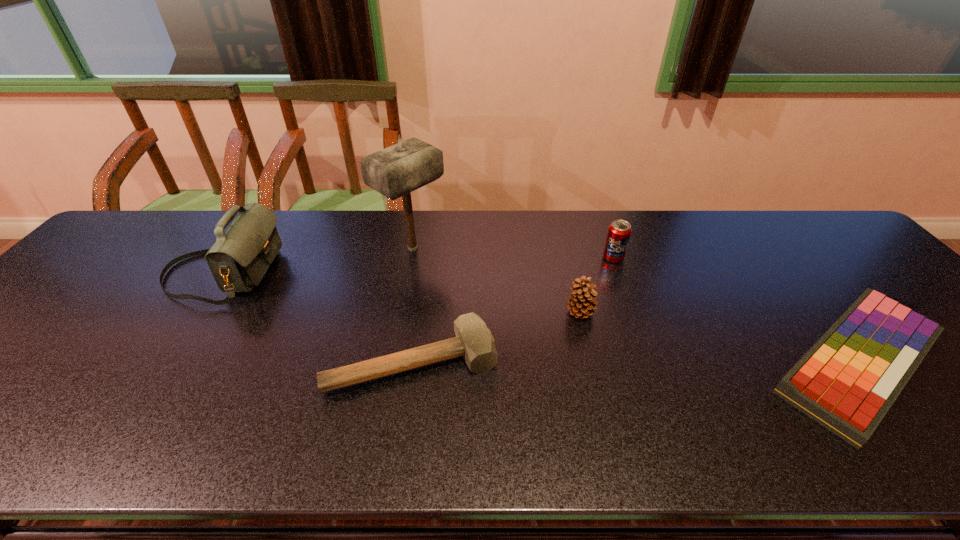
Where is `vacant area located on the back of the soda can`? The image size is (960, 540). vacant area located on the back of the soda can is located at coordinates (607, 239).

I want to click on free location located 0.330m on the left of the shorter mallet, so click(181, 362).

Locate an element on the screen. mallet that is positioned at the far edge is located at coordinates click(x=396, y=171).

Where is `shoulder bag at the far edge`? The height and width of the screenshot is (540, 960). shoulder bag at the far edge is located at coordinates (238, 260).

I want to click on soda can that is at the far edge, so click(619, 231).

Locate an element on the screen. blank space at the far edge of the desktop is located at coordinates (448, 253).

Identify the location of free space at the near edge of the desktop. The height and width of the screenshot is (540, 960). (937, 428).

I want to click on blank space at the left edge of the desktop, so click(x=15, y=354).

I want to click on vacant space at the right edge of the desktop, so click(904, 299).

Where is `free space between the farther mallet and the leftmost object`? free space between the farther mallet and the leftmost object is located at coordinates (317, 261).